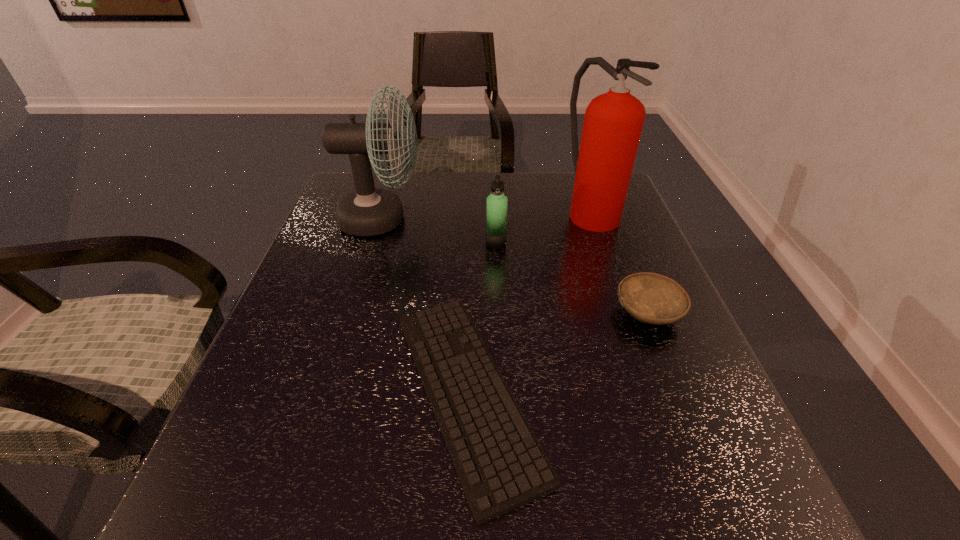
You are a GUI agent. You are given a task and a screenshot of the screen. Output one action in this format:
    pyautogui.click(x=<x>, y=<y>)
    Task: Click on the vacant space that is in between the third shortest object and the computer keyboard
    
    Given the screenshot: What is the action you would take?
    pyautogui.click(x=482, y=318)

I want to click on empty space that is in between the third shortest object and the computer keyboard, so click(482, 318).

Where is `empty space between the tallest object and the thermos bottle`? empty space between the tallest object and the thermos bottle is located at coordinates (543, 227).

Locate an element on the screen. the fourth closest object relative to the shortest object is located at coordinates (613, 122).

Identify which object is the fourth nearest to the tallest object. Please provide its 2D coordinates. Your answer should be formatted as a tuple, i.e. [(x, y)], where the tuple contains the x and y coordinates of a point satisfying the conditions above.

[(369, 211)]

You are a GUI agent. You are given a task and a screenshot of the screen. Output one action in this format:
    pyautogui.click(x=<x>, y=<y>)
    Task: Click on the vacant space that satisfies the following two spatial constraints: 1. in front of the fan where the airflow is directed; 2. on the left side of the computer keyboard
    
    Given the screenshot: What is the action you would take?
    pyautogui.click(x=329, y=392)

The image size is (960, 540). What are the coordinates of `vacant area that satisfies the following two spatial constraints: 1. on the handle side of the fire extinguisher; 2. in front of the second tallest object where the airflow is directed` in the screenshot? It's located at (594, 219).

Identify the location of vacant space that satisfies the following two spatial constraints: 1. on the handle side of the second shortest object; 2. on the right side of the tallest object. (627, 313).

This screenshot has width=960, height=540. What are the coordinates of `vacant space that satisfies the following two spatial constraints: 1. in front of the bowl where the airflow is directed; 2. on the left side of the fourth shortest object` in the screenshot? It's located at (353, 313).

You are a GUI agent. You are given a task and a screenshot of the screen. Output one action in this format:
    pyautogui.click(x=<x>, y=<y>)
    Task: Click on the vacant region that satisfies the following two spatial constraints: 1. in front of the second tallest object where the airflow is directed; 2. on the left side of the second shortest object
    
    Given the screenshot: What is the action you would take?
    click(353, 313)